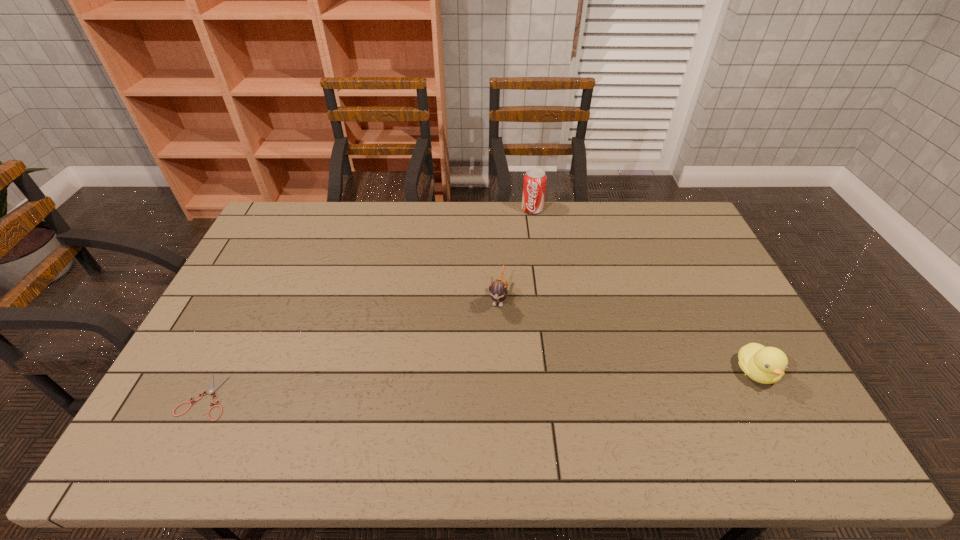
Where is `free space on the desktop that is between the leftmost object and the rightmost object and is positioned on the front-facing side of the second farthest object`? The height and width of the screenshot is (540, 960). free space on the desktop that is between the leftmost object and the rightmost object and is positioned on the front-facing side of the second farthest object is located at coordinates click(x=480, y=384).

Locate an element on the screen. The image size is (960, 540). vacant space on the desktop that is between the leftmost object and the duckling and is positioned on the logo side of the tallest object is located at coordinates (466, 385).